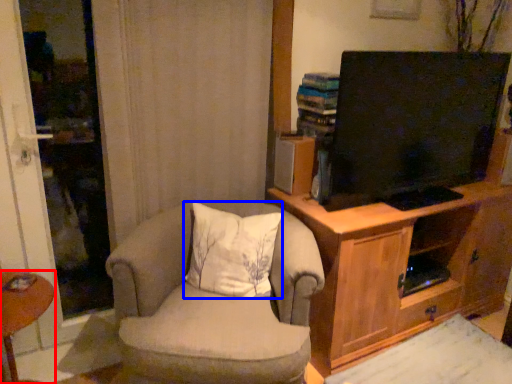
Question: Which of the following is the farthest to the observer, desk (highlighted by a red box) or pillow (highlighted by a blue box)?

Choices:
 (A) desk
 (B) pillow

Answer: (B)